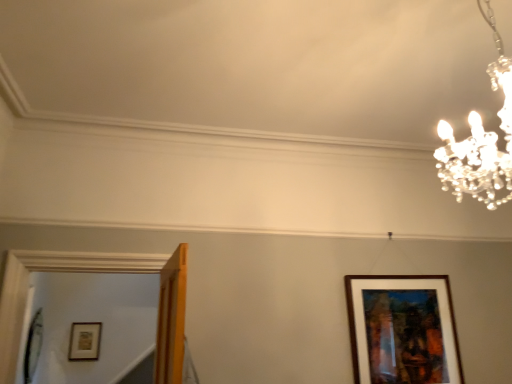
Question: Is clear crystal chandelier at upper right bigger or smaller than brown wooden picture frame at lower right, which ranks as the second picture frame in bottom-to-top order?

Choices:
 (A) big
 (B) small

Answer: (A)

Question: Looking at their shapes, would you say clear crystal chandelier at upper right is wider or thinner than brown wooden picture frame at lower right, arranged as the 1th picture frame when viewed from the front?

Choices:
 (A) wide
 (B) thin

Answer: (A)

Question: Which object is positioned farthest from the clear crystal chandelier at upper right?

Choices:
 (A) wooden picture frame at lower left, arranged as the 1th picture frame when viewed from the back
 (B) brown wooden picture frame at lower right, arranged as the 1th picture frame when viewed from the front

Answer: (A)

Question: Which of these objects is positioned farthest from the clear crystal chandelier at upper right?

Choices:
 (A) brown wooden picture frame at lower right, acting as the first picture frame starting from the top
 (B) wooden picture frame at lower left, arranged as the 1th picture frame when viewed from the back

Answer: (B)